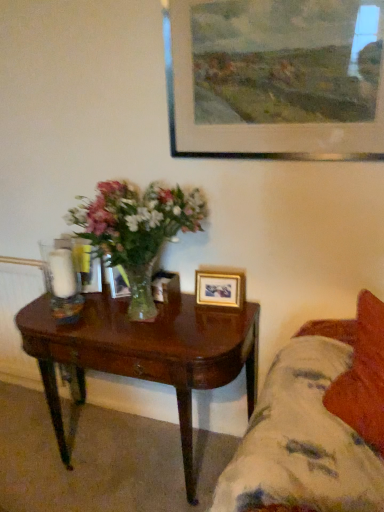
Question: From a real-world perspective, is white glass candle holder at left physically above wooden picture frame at center, the 3th picture frame when ordered from top to bottom?

Choices:
 (A) yes
 (B) no

Answer: (A)

Question: Is white glass candle holder at left positioned before wooden picture frame at center, which is counted as the first picture frame, starting from the back?

Choices:
 (A) no
 (B) yes

Answer: (B)

Question: From the image's perspective, does white glass candle holder at left appear lower than wooden picture frame at center, which is counted as the first picture frame, starting from the back?

Choices:
 (A) yes
 (B) no

Answer: (B)

Question: Can you confirm if white glass candle holder at left is taller than wooden picture frame at center, which is counted as the first picture frame, starting from the back?

Choices:
 (A) yes
 (B) no

Answer: (A)

Question: Does white glass candle holder at left lie behind wooden picture frame at center, the 3th picture frame when ordered from top to bottom?

Choices:
 (A) no
 (B) yes

Answer: (A)

Question: Is white glass candle holder at left shorter than wooden picture frame at center, which is counted as the first picture frame, starting from the back?

Choices:
 (A) yes
 (B) no

Answer: (B)

Question: Is wooden picture frame at upper center, which is the third picture frame from bottom to top, further to the viewer compared to wooden picture frame at center, which is counted as the first picture frame, starting from the back?

Choices:
 (A) yes
 (B) no

Answer: (B)

Question: Can you confirm if wooden picture frame at upper center, which is the third picture frame from bottom to top, is shorter than wooden picture frame at center, the 3th picture frame when ordered from top to bottom?

Choices:
 (A) yes
 (B) no

Answer: (B)

Question: Is wooden picture frame at upper center, which is the third picture frame from bottom to top, wider than wooden picture frame at center, which is counted as the first picture frame, starting from the back?

Choices:
 (A) yes
 (B) no

Answer: (B)

Question: Considering the relative sizes of wooden picture frame at upper center, positioned as the third picture frame in back-to-front order, and wooden picture frame at center, the first picture frame positioned from the bottom, in the image provided, is wooden picture frame at upper center, positioned as the third picture frame in back-to-front order, thinner than wooden picture frame at center, the first picture frame positioned from the bottom,?

Choices:
 (A) yes
 (B) no

Answer: (A)

Question: Is wooden picture frame at upper center, which is the 1th picture frame in front-to-back order, at the right side of wooden picture frame at center, which is the third picture frame in front-to-back order?

Choices:
 (A) no
 (B) yes

Answer: (B)

Question: From a real-world perspective, is wooden picture frame at upper center, positioned as the third picture frame in back-to-front order, located higher than wooden picture frame at center, which is counted as the first picture frame, starting from the back?

Choices:
 (A) no
 (B) yes

Answer: (B)

Question: Is fluffy fabric couch at lower right at the right side of wooden picture frame at upper center, which is the 1th picture frame in front-to-back order?

Choices:
 (A) yes
 (B) no

Answer: (A)